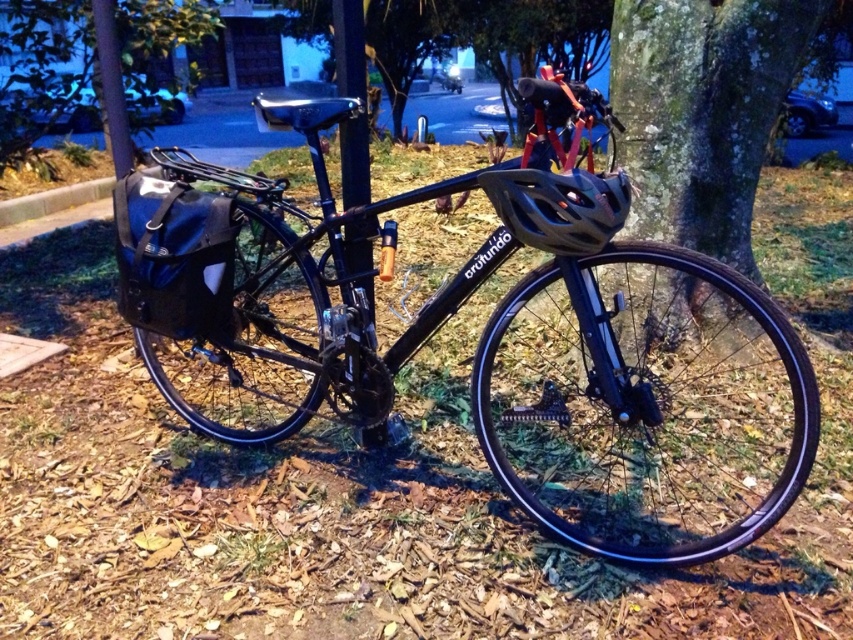
Is black matte bicycle at center taller than green mossy bark at center?

Incorrect, black matte bicycle at center's height is not larger of green mossy bark at center's.

Can you confirm if black matte bicycle at center is bigger than green mossy bark at center?

Correct, black matte bicycle at center is larger in size than green mossy bark at center.

Identify the location of black matte bicycle at center. (645, 403).

At what (x,y) coordinates should I click in order to perform the action: click on black matte bicycle at center. Please return your answer as a coordinate pair (x, y). The height and width of the screenshot is (640, 853). Looking at the image, I should click on (645, 403).

Is green mossy bark at center below green leafy tree at center?

Yes, green mossy bark at center is below green leafy tree at center.

Can you confirm if green mossy bark at center is positioned to the right of green leafy tree at center?

Correct, you'll find green mossy bark at center to the right of green leafy tree at center.

Where is `green mossy bark at center`? green mossy bark at center is located at coordinates (701, 112).

Where is `green mossy bark at center`? green mossy bark at center is located at coordinates click(701, 112).

Is black matte bicycle at center to the left of green leafy tree at center from the viewer's perspective?

No, black matte bicycle at center is not to the left of green leafy tree at center.

Which is more to the left, black matte bicycle at center or green leafy tree at center?

green leafy tree at center is more to the left.

What are the coordinates of `black matte bicycle at center` in the screenshot? It's located at (645, 403).

The height and width of the screenshot is (640, 853). What are the coordinates of `black matte bicycle at center` in the screenshot? It's located at (645, 403).